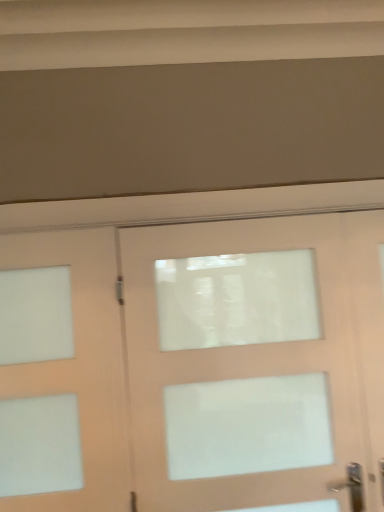
Question: Should I look upward or downward to see matte white door at left, acting as the first door starting from the left?

Choices:
 (A) up
 (B) down

Answer: (B)

Question: Is matte white door at left, acting as the first door starting from the left, to the left of white matte door at center, arranged as the second door when viewed from the left, from the viewer's perspective?

Choices:
 (A) no
 (B) yes

Answer: (B)

Question: Does matte white door at left, arranged as the 2th door when viewed from the right, turn towards white matte door at center, arranged as the second door when viewed from the left?

Choices:
 (A) no
 (B) yes

Answer: (A)

Question: Is matte white door at left, acting as the first door starting from the left, at the right side of white matte door at center, acting as the first door starting from the right?

Choices:
 (A) no
 (B) yes

Answer: (A)

Question: From the image's perspective, is matte white door at left, arranged as the 2th door when viewed from the right, beneath white matte door at center, arranged as the second door when viewed from the left?

Choices:
 (A) yes
 (B) no

Answer: (B)

Question: From a real-world perspective, does matte white door at left, acting as the first door starting from the left, stand above white matte door at center, arranged as the second door when viewed from the left?

Choices:
 (A) yes
 (B) no

Answer: (A)

Question: Is matte white door at left, acting as the first door starting from the left, in contact with white matte door at center, arranged as the second door when viewed from the left?

Choices:
 (A) yes
 (B) no

Answer: (B)

Question: Does white matte door at center, arranged as the second door when viewed from the left, have a lesser width compared to matte white door at left, acting as the first door starting from the left?

Choices:
 (A) yes
 (B) no

Answer: (B)

Question: Does white matte door at center, arranged as the second door when viewed from the left, have a greater height compared to matte white door at left, arranged as the 2th door when viewed from the right?

Choices:
 (A) no
 (B) yes

Answer: (B)

Question: Is matte white door at left, acting as the first door starting from the left, a part of white matte door at center, acting as the first door starting from the right?

Choices:
 (A) yes
 (B) no

Answer: (B)

Question: From a real-world perspective, is white matte door at center, acting as the first door starting from the right, positioned under matte white door at left, arranged as the 2th door when viewed from the right, based on gravity?

Choices:
 (A) no
 (B) yes

Answer: (B)

Question: Does white matte door at center, acting as the first door starting from the right, come behind matte white door at left, acting as the first door starting from the left?

Choices:
 (A) yes
 (B) no

Answer: (B)

Question: Is white matte door at center, arranged as the second door when viewed from the left, positioned in front of matte white door at left, acting as the first door starting from the left?

Choices:
 (A) no
 (B) yes

Answer: (B)

Question: Is white matte door at center, arranged as the second door when viewed from the left, inside or outside of matte white door at left, arranged as the 2th door when viewed from the right?

Choices:
 (A) outside
 (B) inside

Answer: (A)